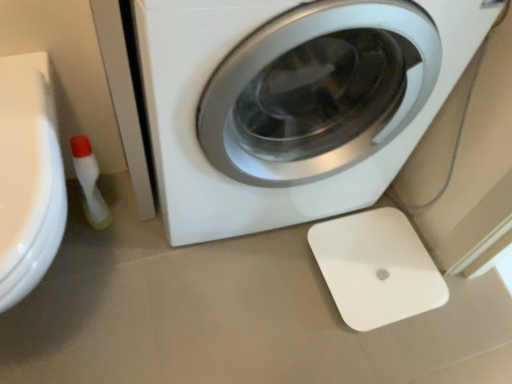
Find the location of `free area in between translucent plastic bottle at lower left and white plastic scale at lower right`. free area in between translucent plastic bottle at lower left and white plastic scale at lower right is located at coordinates 241,260.